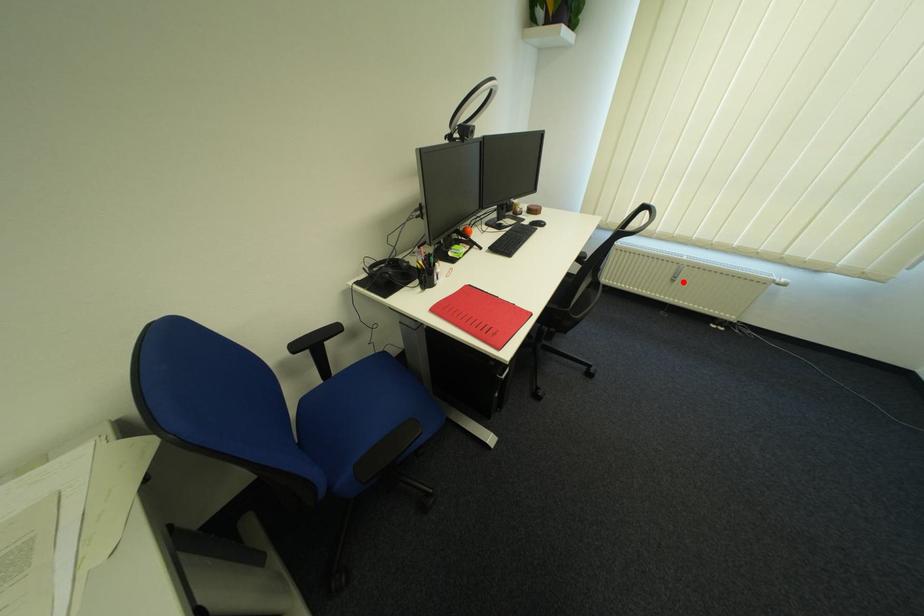
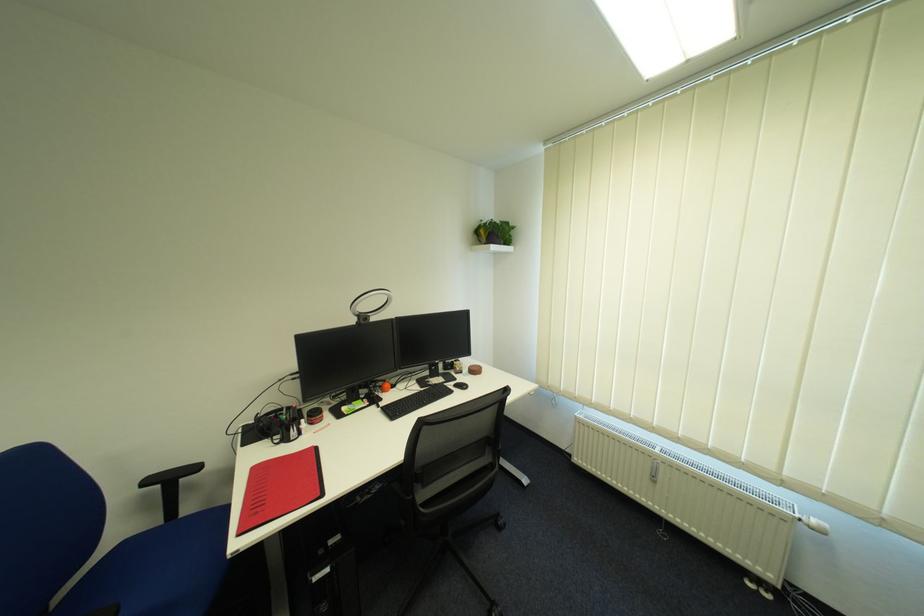
Question: I am providing you with two images of the same scene from different viewpoints. In image1, a red point is highlighted. Considering the same 3D point in image2, which of the following is correct?

Choices:
 (A) It is closer
 (B) It is farther

Answer: (B)